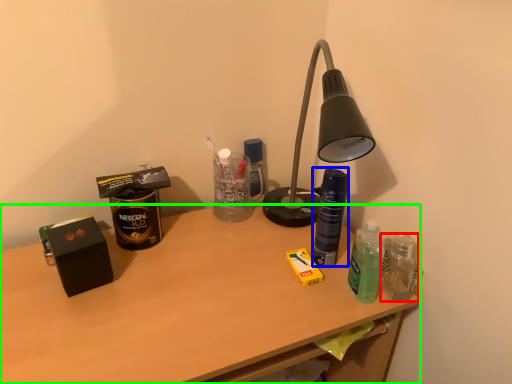
Question: Which object is the closest to the bottle (highlighted by a red box)? Choose among these: bottle (highlighted by a blue box) or desk (highlighted by a green box).

Choices:
 (A) bottle
 (B) desk

Answer: (A)